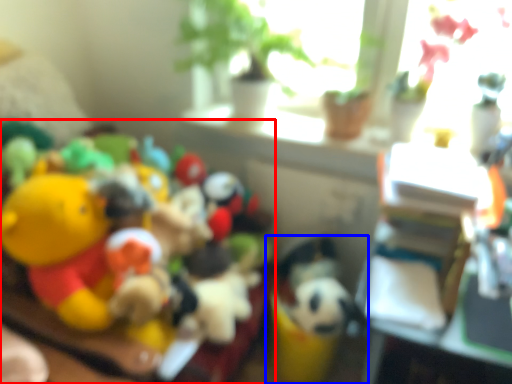
Question: Among these objects, which one is nearest to the camera, toy (highlighted by a red box) or toy (highlighted by a blue box)?

Choices:
 (A) toy
 (B) toy

Answer: (A)